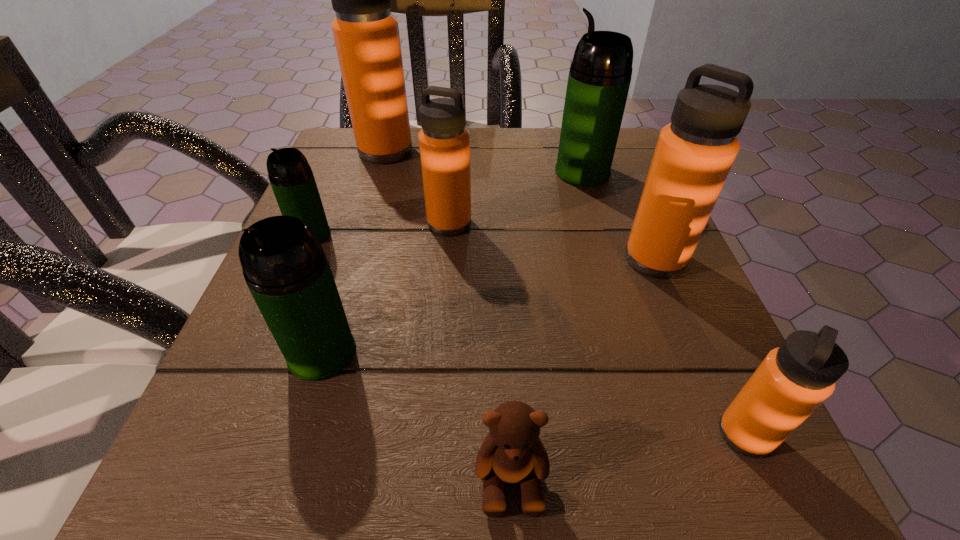
Identify the location of empty space between the teddy bear and the farthest green thermos bottle. (546, 325).

The width and height of the screenshot is (960, 540). I want to click on vacant space that's between the leftmost orange thermos bottle and the second smallest green thermos bottle, so click(354, 252).

This screenshot has height=540, width=960. Find the location of `unoccupied area between the teddy bear and the second farthest orange thermos bottle`. unoccupied area between the teddy bear and the second farthest orange thermos bottle is located at coordinates (480, 350).

Where is `the fifth closest object to the third farthest orange thermos bottle`? The height and width of the screenshot is (540, 960). the fifth closest object to the third farthest orange thermos bottle is located at coordinates (285, 268).

Locate an element on the screen. The height and width of the screenshot is (540, 960). the seventh closest object to the biggest green thermos bottle is located at coordinates (512, 452).

Choose which thermos bottle is the fourth nearest neighbor to the rightmost green thermos bottle. Please provide its 2D coordinates. Your answer should be formatted as a tuple, i.e. [(x, y)], where the tuple contains the x and y coordinates of a point satisfying the conditions above.

[(290, 175)]

This screenshot has width=960, height=540. Find the location of `thermos bottle that is the third closest to the second smallest green thermos bottle`. thermos bottle that is the third closest to the second smallest green thermos bottle is located at coordinates (694, 154).

Find the location of a particular element. The image size is (960, 540). orange thermos bottle that is the second closest to the rightmost green thermos bottle is located at coordinates (444, 142).

This screenshot has height=540, width=960. I want to click on orange thermos bottle that is the nearest to the second farthest green thermos bottle, so click(444, 142).

The height and width of the screenshot is (540, 960). Identify the location of green thermos bottle that is the third closest to the farthest orange thermos bottle. (285, 268).